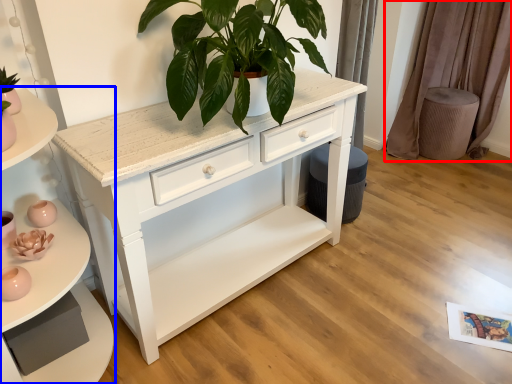
Question: Among these objects, which one is farthest to the camera, curtain (highlighted by a red box) or shelf (highlighted by a blue box)?

Choices:
 (A) curtain
 (B) shelf

Answer: (A)